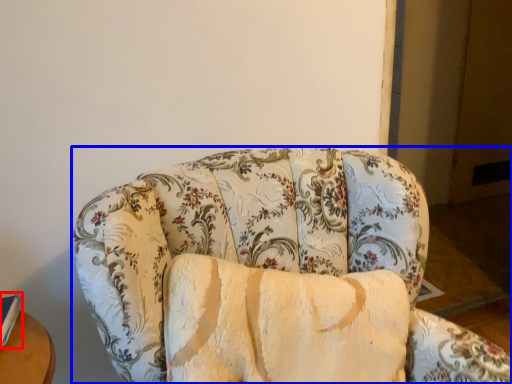
Question: Which of the following is the closest to the observer, book (highlighted by a red box) or studio couch (highlighted by a blue box)?

Choices:
 (A) book
 (B) studio couch

Answer: (B)